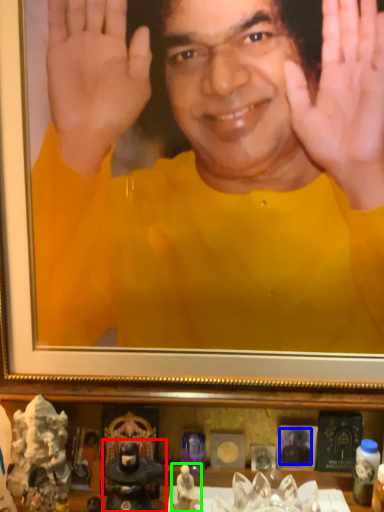
Question: Based on their relative distances, which object is farther from figurine (highlighted by a red box)? Choose from man (highlighted by a blue box) and toy (highlighted by a green box).

Choices:
 (A) man
 (B) toy

Answer: (A)